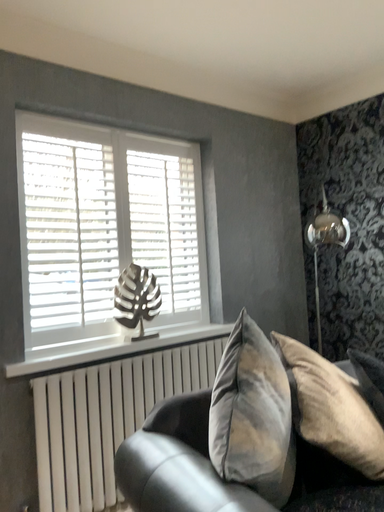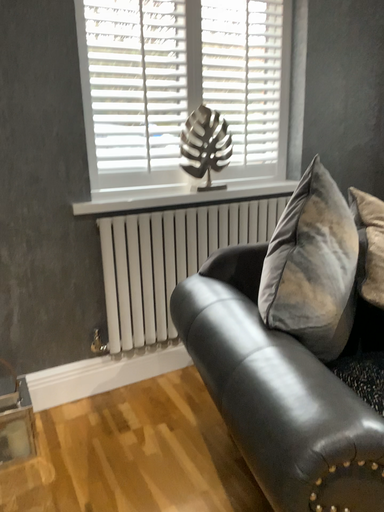
Question: How did the camera likely rotate when shooting the video?

Choices:
 (A) rotated left
 (B) rotated right

Answer: (A)